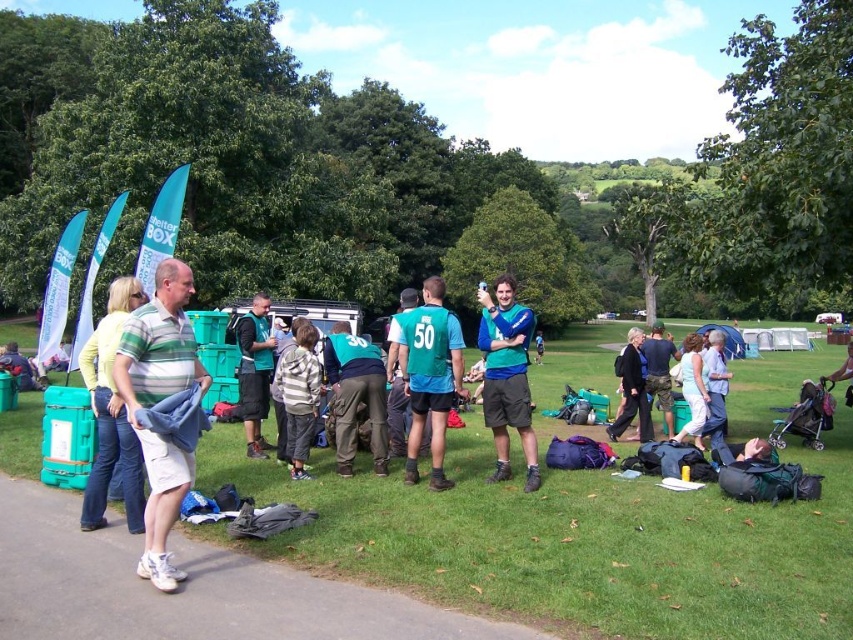
You are standing at point (576, 541) in the park. What is the terrain like here?

The terrain at point (576, 541) is green grass at center.

You are a photographer trying to capture a wide shot of the green grass at center and the striped hoodie at center. Based on their sizes in the image, which object would you need to position your camera closer to in order to ensure both are fully in frame?

The green grass at center might be wider than striped hoodie at center, so you should position your camera closer to the green grass at center to ensure both are fully in frame.

You are standing at the point marked by the coordinates point (576, 541). What is the terrain like at your current location?

The point (576, 541) indicates green grass at center, so the terrain is grassy.